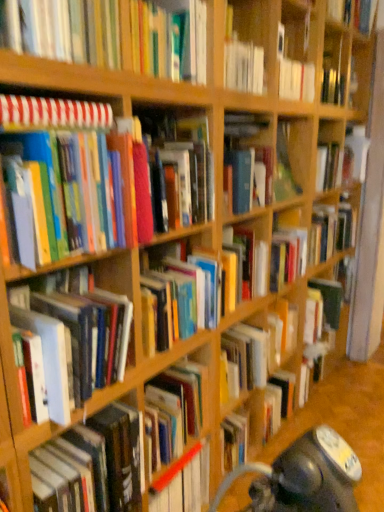
Where is `hardcover book at upper right, arranged as the 1th book when viewed from the top`? Image resolution: width=384 pixels, height=512 pixels. hardcover book at upper right, arranged as the 1th book when viewed from the top is located at coordinates (354, 13).

Describe the element at coordinates (260, 345) in the screenshot. I see `hardcover book at center, positioned as the second book in bottom-to-top order` at that location.

This screenshot has width=384, height=512. What are the coordinates of `hardcover book at left, which appears as the eighth book when viewed from the top` in the screenshot? It's located at point(110,452).

In order to click on hardcover book at upper center, the 7th book positioned from the bottom in this screenshot , I will do `click(71, 30)`.

In order to face hardcover book at upper center, arranged as the second book when viewed from the top, should I rotate leftwards or rightwards?

Turn left by 8.380 degrees to look at hardcover book at upper center, arranged as the second book when viewed from the top.

Locate an element on the screen. The height and width of the screenshot is (512, 384). hardcover book at upper right, arranged as the 1th book when viewed from the top is located at coordinates (354, 13).

Is hardcover book at left, marked as the first book in a bottom-to-top arrangement, at the back of striped paper notebook at upper left, the sixth book from the bottom?

No, striped paper notebook at upper left, the sixth book from the bottom, is not facing the opposite direction of hardcover book at left, marked as the first book in a bottom-to-top arrangement.

Which of these two, striped paper notebook at upper left, positioned as the 3th book in top-to-bottom order, or hardcover book at left, which appears as the eighth book when viewed from the top, stands taller?

hardcover book at left, which appears as the eighth book when viewed from the top, is taller.

The image size is (384, 512). Identify the location of book that is the 4th object directly below the striped paper notebook at upper left, positioned as the 3th book in top-to-bottom order (from a real-world perspective). (110, 452).

Which of these two, hardcover book at center, arranged as the fifth book when ordered from the bottom, or hardcover book at upper center, the 7th book positioned from the bottom, is wider?

With larger width is hardcover book at upper center, the 7th book positioned from the bottom.

Is hardcover book at center, arranged as the fifth book when ordered from the bottom, far from hardcover book at upper center, the 7th book positioned from the bottom?

Yes.

From the image's perspective, which is below, hardcover book at center, the 4th book positioned from the top, or hardcover book at upper center, the 7th book positioned from the bottom?

From the image's view, hardcover book at center, the 4th book positioned from the top, is below.

Is hardcover book at center, arranged as the fifth book when ordered from the bottom, oriented away from hardcover book at upper center, the 7th book positioned from the bottom?

No, hardcover book at upper center, the 7th book positioned from the bottom, is not at the back of hardcover book at center, arranged as the fifth book when ordered from the bottom.

Is the surface of hardcover book at left, marked as the first book in a bottom-to-top arrangement, in direct contact with hardcover book at center, arranged as the fifth book when ordered from the bottom?

There is a gap between hardcover book at left, marked as the first book in a bottom-to-top arrangement, and hardcover book at center, arranged as the fifth book when ordered from the bottom.

Based on the photo, is hardcover book at left, which appears as the eighth book when viewed from the top, smaller than hardcover book at center, the 4th book positioned from the top?

No.

Who is shorter, hardcover book at left, marked as the first book in a bottom-to-top arrangement, or hardcover book at center, arranged as the fifth book when ordered from the bottom?

hardcover book at left, marked as the first book in a bottom-to-top arrangement, is shorter.

Based on the photo, does hardcover book at left, which appears as the eighth book when viewed from the top, turn towards hardcover book at center, arranged as the fifth book when ordered from the bottom?

No, hardcover book at left, which appears as the eighth book when viewed from the top, is not aimed at hardcover book at center, arranged as the fifth book when ordered from the bottom.

Which of these two, hardcover book at left, acting as the sixth book starting from the top, or hardcover book at center, the seventh book when ordered from top to bottom, stands shorter?

With less height is hardcover book at center, the seventh book when ordered from top to bottom.

Can you confirm if hardcover book at left, acting as the sixth book starting from the top, is wider than hardcover book at center, the seventh book when ordered from top to bottom?

Correct, the width of hardcover book at left, acting as the sixth book starting from the top, exceeds that of hardcover book at center, the seventh book when ordered from top to bottom.

Is hardcover book at left, acting as the sixth book starting from the top, positioned beyond the bounds of hardcover book at center, positioned as the second book in bottom-to-top order?

That's correct, hardcover book at left, acting as the sixth book starting from the top, is outside of hardcover book at center, positioned as the second book in bottom-to-top order.

Who is bigger, hardcover book at left, acting as the sixth book starting from the top, or hardcover book at center, positioned as the second book in bottom-to-top order?

With larger size is hardcover book at left, acting as the sixth book starting from the top.

Can you confirm if hardcover book at left, which appears as the eighth book when viewed from the top, is bigger than matte hardcover books at left, the 5th book in the top-to-bottom sequence?

Actually, hardcover book at left, which appears as the eighth book when viewed from the top, might be smaller than matte hardcover books at left, the 5th book in the top-to-bottom sequence.

From a real-world perspective, does hardcover book at left, which appears as the eighth book when viewed from the top, sit lower than matte hardcover books at left, marked as the fourth book in a bottom-to-top arrangement?

Yes, from a real-world perspective, hardcover book at left, which appears as the eighth book when viewed from the top, is under matte hardcover books at left, marked as the fourth book in a bottom-to-top arrangement.

Is hardcover book at left, marked as the first book in a bottom-to-top arrangement, with matte hardcover books at left, marked as the fourth book in a bottom-to-top arrangement?

hardcover book at left, marked as the first book in a bottom-to-top arrangement, and matte hardcover books at left, marked as the fourth book in a bottom-to-top arrangement, are clearly separated.

Does point (108, 420) come farther from viewer compared to point (48, 189)?

Yes, it is.

Which of these two, hardcover book at center, the 4th book positioned from the top, or hardcover book at left, which appears as the eighth book when viewed from the top, stands shorter?

hardcover book at left, which appears as the eighth book when viewed from the top, is shorter.

Is hardcover book at center, arranged as the fifth book when ordered from the bottom, in front of or behind hardcover book at left, marked as the first book in a bottom-to-top arrangement, in the image?

hardcover book at center, arranged as the fifth book when ordered from the bottom, is positioned farther from the viewer than hardcover book at left, marked as the first book in a bottom-to-top arrangement.

Are hardcover book at center, the 4th book positioned from the top, and hardcover book at left, marked as the first book in a bottom-to-top arrangement, far apart?

Absolutely, hardcover book at center, the 4th book positioned from the top, is distant from hardcover book at left, marked as the first book in a bottom-to-top arrangement.

The width and height of the screenshot is (384, 512). In order to click on the 4th book positioned below the hardcover book at center, the 4th book positioned from the top (from the image's perspective) in this screenshot , I will do `click(110, 452)`.

Who is bigger, hardcover book at left, which appears as the eighth book when viewed from the top, or striped paper notebook at upper left, positioned as the 3th book in top-to-bottom order?

Bigger between the two is hardcover book at left, which appears as the eighth book when viewed from the top.

Between hardcover book at left, which appears as the eighth book when viewed from the top, and striped paper notebook at upper left, positioned as the 3th book in top-to-bottom order, which one has smaller width?

striped paper notebook at upper left, positioned as the 3th book in top-to-bottom order.

From a real-world perspective, is hardcover book at left, marked as the first book in a bottom-to-top arrangement, under striped paper notebook at upper left, positioned as the 3th book in top-to-bottom order?

Indeed, from a real-world perspective, hardcover book at left, marked as the first book in a bottom-to-top arrangement, is positioned beneath striped paper notebook at upper left, positioned as the 3th book in top-to-bottom order.

From the image's perspective, is hardcover book at left, which appears as the eighth book when viewed from the top, above striped paper notebook at upper left, the sixth book from the bottom?

Actually, hardcover book at left, which appears as the eighth book when viewed from the top, appears below striped paper notebook at upper left, the sixth book from the bottom, in the image.

From a real-world perspective, count 4th books upward from the hardcover book at left, which appears as the eighth book when viewed from the top, and point to it. Please provide its 2D coordinates.

[(53, 112)]

Identify the location of the 3rd book located beneath the hardcover book at upper center, arranged as the second book when viewed from the top (from a real-world perspective). Image resolution: width=384 pixels, height=512 pixels. (330, 231).

Estimate the real-world distances between objects in this image. Which object is further from hardcover book at upper center, arranged as the second book when viewed from the top, hardcover book at center, arranged as the fifth book when ordered from the bottom, or striped paper notebook at upper left, the sixth book from the bottom?

hardcover book at center, arranged as the fifth book when ordered from the bottom, lies further to hardcover book at upper center, arranged as the second book when viewed from the top, than the other object.

When comparing their distances from hardcover book at left, which appears as the eighth book when viewed from the top, does hardcover book at upper center, the 7th book positioned from the bottom, or hardcover book at upper right, arranged as the 1th book when viewed from the top, seem closer?

hardcover book at upper center, the 7th book positioned from the bottom, is closer to hardcover book at left, which appears as the eighth book when viewed from the top.

Estimate the real-world distances between objects in this image. Which object is further from hardcover book at center, arranged as the fifth book when ordered from the bottom, hardcover book at center, the seventh book when ordered from top to bottom, or hardcover book at left, which appears as the eighth book when viewed from the top?

Among the two, hardcover book at left, which appears as the eighth book when viewed from the top, is located further to hardcover book at center, arranged as the fifth book when ordered from the bottom.

Which object lies further to the anchor point matte hardcover books at left, the 5th book in the top-to-bottom sequence, hardcover book at left, placed as the 3th book when sorted from bottom to top, or striped paper notebook at upper left, the sixth book from the bottom?

hardcover book at left, placed as the 3th book when sorted from bottom to top.

Estimate the real-world distances between objects in this image. Which object is closer to striped paper notebook at upper left, the sixth book from the bottom, hardcover book at left, acting as the sixth book starting from the top, or hardcover book at upper right, the eighth book ordered from the bottom?

hardcover book at left, acting as the sixth book starting from the top, is closer to striped paper notebook at upper left, the sixth book from the bottom.

When comparing their distances from hardcover book at upper center, arranged as the second book when viewed from the top, does matte hardcover books at left, marked as the fourth book in a bottom-to-top arrangement, or hardcover book at center, the 4th book positioned from the top, seem further?

hardcover book at center, the 4th book positioned from the top.

Which object lies further to the anchor point hardcover book at left, placed as the 3th book when sorted from bottom to top, hardcover book at center, positioned as the second book in bottom-to-top order, or matte hardcover books at left, marked as the fourth book in a bottom-to-top arrangement?

Based on the image, hardcover book at center, positioned as the second book in bottom-to-top order, appears to be further to hardcover book at left, placed as the 3th book when sorted from bottom to top.

Looking at this image, considering their positions, is hardcover book at left, marked as the first book in a bottom-to-top arrangement, positioned closer to hardcover book at upper center, arranged as the second book when viewed from the top, than matte hardcover books at left, marked as the fourth book in a bottom-to-top arrangement?

matte hardcover books at left, marked as the fourth book in a bottom-to-top arrangement, lies closer to hardcover book at upper center, arranged as the second book when viewed from the top, than the other object.